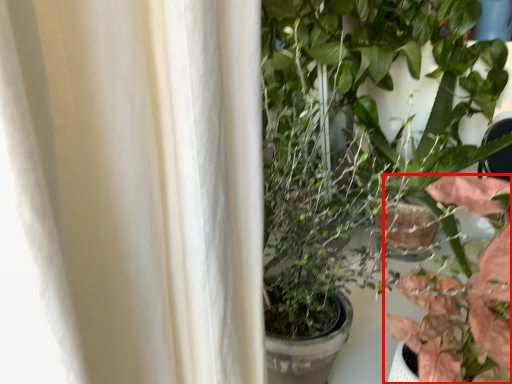
Question: Observing the image, what is the correct spatial positioning of houseplant (annotated by the red box) in reference to houseplant?

Choices:
 (A) right
 (B) left

Answer: (B)